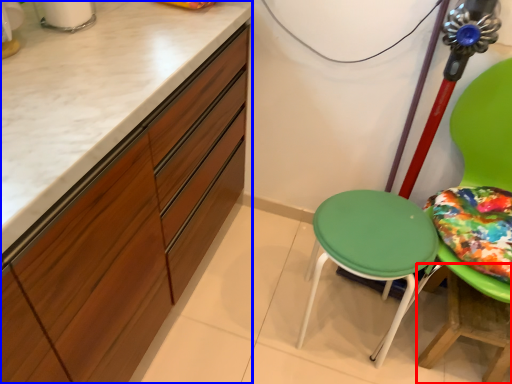
Question: Which of the following is the closest to the observer, table (highlighted by a red box) or cabinetry (highlighted by a blue box)?

Choices:
 (A) table
 (B) cabinetry

Answer: (B)